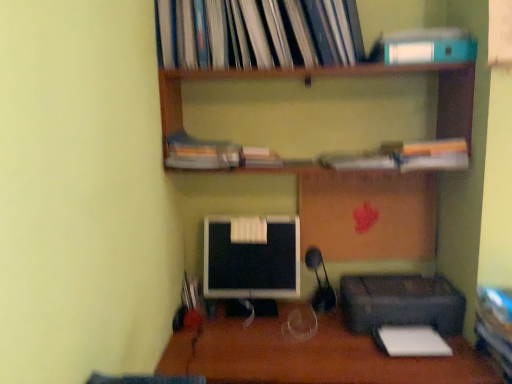
This screenshot has height=384, width=512. In order to click on free space above wooden desk at center (from a real-world perspective) in this screenshot , I will do `click(290, 336)`.